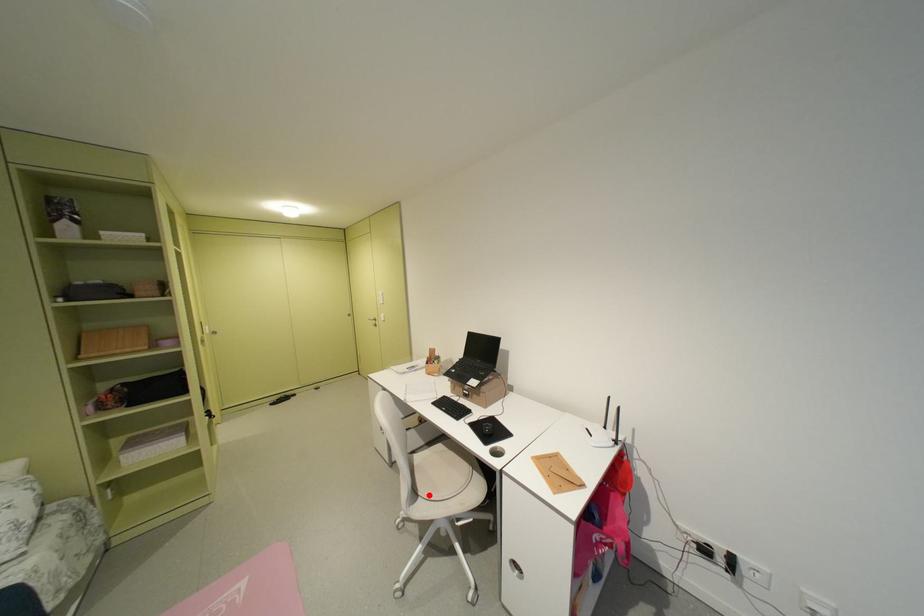
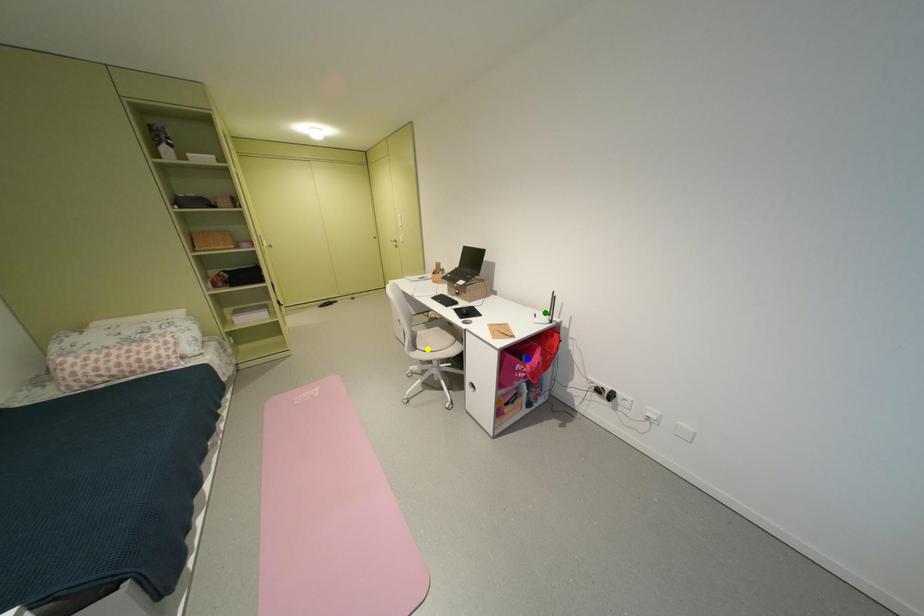
Question: I am providing you with two images of the same scene from different viewpoints. A red point is marked on the first image. You are given multiple points on the second image. In image 2, which mark is for the same physical point as the one in image 1?

Choices:
 (A) yellow point
 (B) green point
 (C) blue point

Answer: (A)